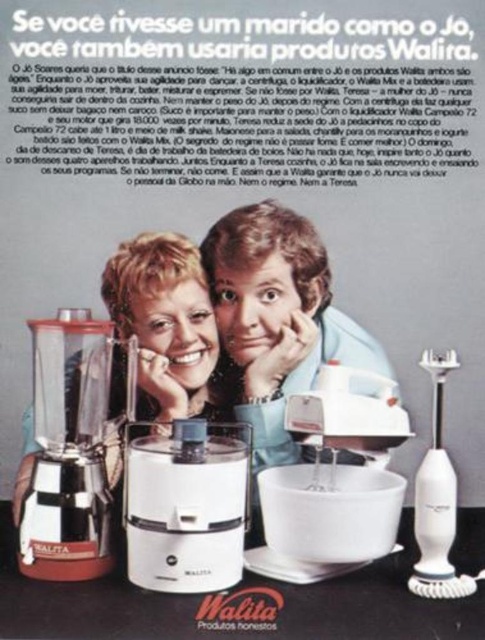
Is matte white hairdryer at center bigger than white plastic mixer at center?

Yes, matte white hairdryer at center is bigger than white plastic mixer at center.

Can you confirm if matte white hairdryer at center is positioned below white plastic mixer at center?

No, matte white hairdryer at center is not below white plastic mixer at center.

Is point (199, 244) farther from camera compared to point (377, 378)?

That is True.

Where is `matte white hairdryer at center`? matte white hairdryer at center is located at coordinates [x=275, y=321].

Looking at this image, measure the distance between matte white hairdryer at center and matte black blender at lower left.

matte white hairdryer at center is 3.61 inches from matte black blender at lower left.

Can you confirm if matte white hairdryer at center is thinner than matte black blender at lower left?

Correct, matte white hairdryer at center's width is less than matte black blender at lower left's.

This screenshot has width=485, height=640. Describe the element at coordinates (275, 321) in the screenshot. I see `matte white hairdryer at center` at that location.

Find the location of a particular element. matte white hairdryer at center is located at coordinates (275, 321).

Does point (78, 600) come in front of point (350, 454)?

Yes, it is in front of point (350, 454).

Between white plastic bowl at center and matte white hairdryer at center, which one is positioned lower?

white plastic bowl at center

Between point (41, 634) and point (238, 380), which one is positioned in front?

Positioned in front is point (41, 634).

Find the location of a particular element. This screenshot has height=640, width=485. white plastic bowl at center is located at coordinates (236, 604).